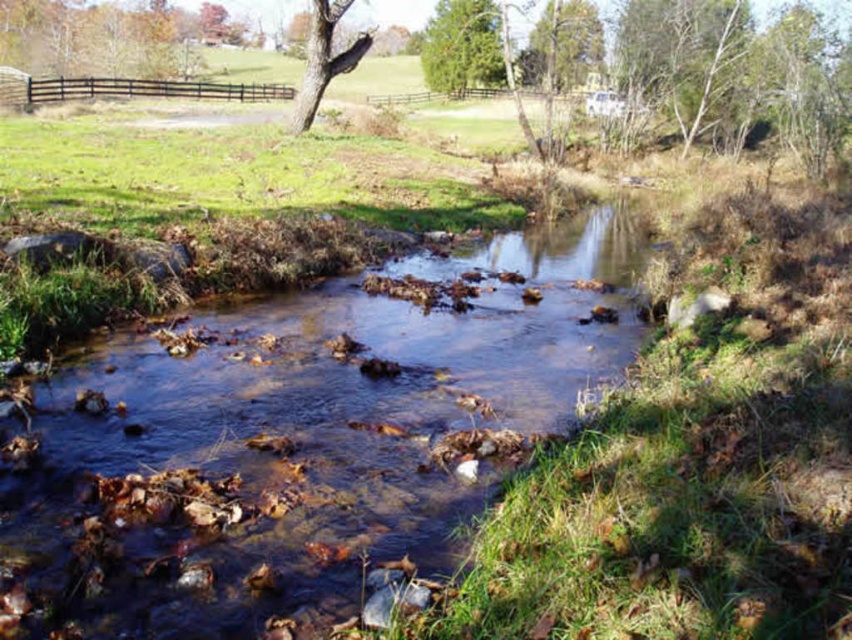
Question: Which is farther from the smooth bark tree at upper center?

Choices:
 (A) translucent brown water at center
 (B) green textured tree at upper center

Answer: (B)

Question: Is translucent brown water at center thinner than smooth bark tree at upper center?

Choices:
 (A) no
 (B) yes

Answer: (B)

Question: Which point is farther from the camera taking this photo?

Choices:
 (A) (456, 54)
 (B) (309, 48)
 (C) (148, 401)

Answer: (A)

Question: Does translucent brown water at center lie behind green textured tree at upper center?

Choices:
 (A) yes
 (B) no

Answer: (B)

Question: Which is farther from the translucent brown water at center?

Choices:
 (A) green textured tree at upper center
 (B) smooth bark tree at upper center

Answer: (A)

Question: Is green textured tree at upper center below smooth bark tree at upper center?

Choices:
 (A) yes
 (B) no

Answer: (B)